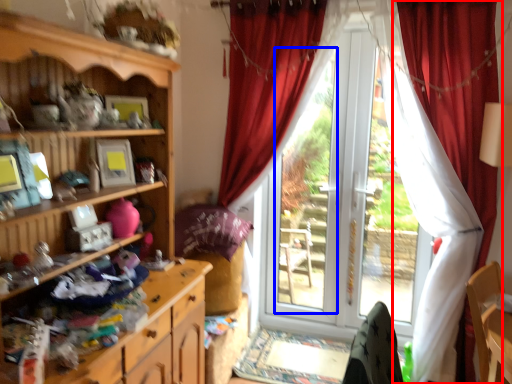
Question: Which point is closer to the camera, curtain (highlighted by a red box) or bay window (highlighted by a blue box)?

Choices:
 (A) curtain
 (B) bay window

Answer: (A)